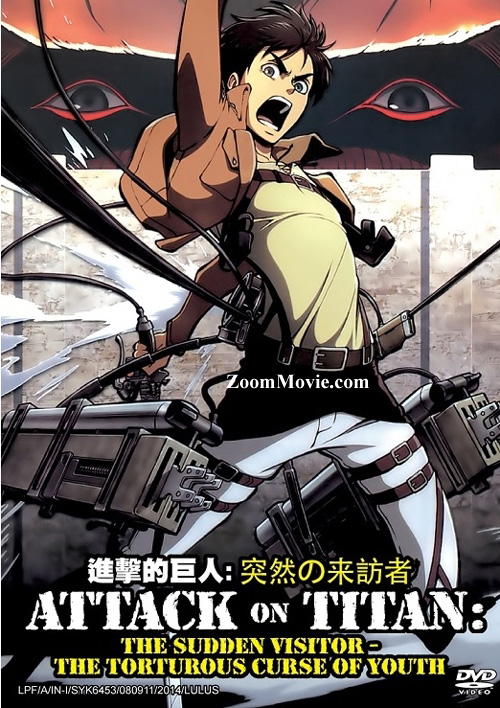
At what (x,y) coordinates should I click in order to perform the action: click on attack on titan poster. Please return your answer as a coordinate pair (x, y). Looking at the image, I should click on (269, 311).